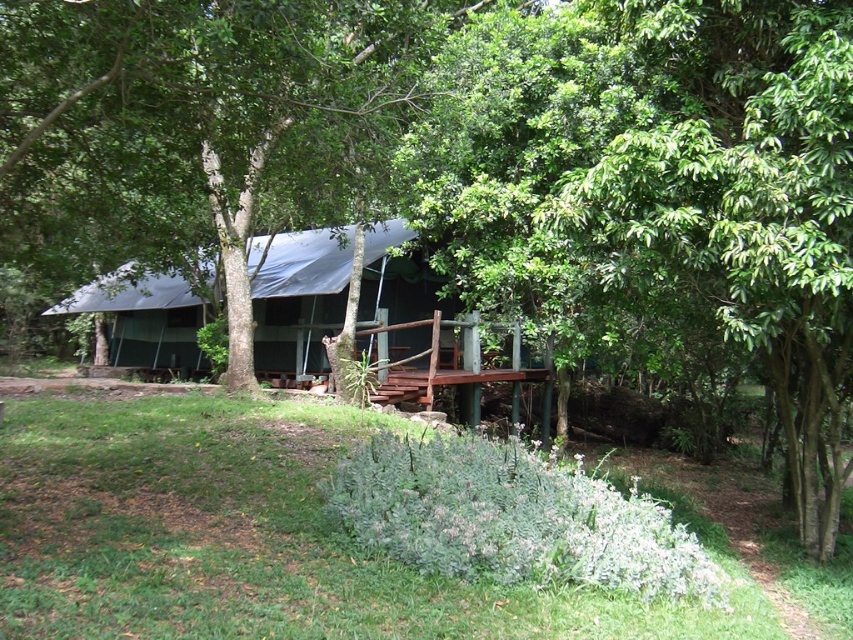
Question: Which point appears closest to the camera in this image?

Choices:
 (A) (251, 268)
 (B) (505, 328)

Answer: (B)

Question: Is white tarpaulin hut at center to the right of white tarpaulin canopy at center from the viewer's perspective?

Choices:
 (A) no
 (B) yes

Answer: (B)

Question: Is white tarpaulin hut at center to the left of white tarpaulin canopy at center from the viewer's perspective?

Choices:
 (A) yes
 (B) no

Answer: (B)

Question: Is white tarpaulin hut at center to the right of white tarpaulin canopy at center from the viewer's perspective?

Choices:
 (A) yes
 (B) no

Answer: (A)

Question: Which of the following is the farthest from the observer?

Choices:
 (A) (370, 230)
 (B) (267, 353)

Answer: (B)